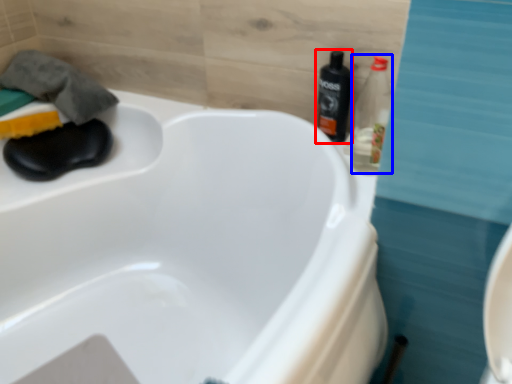
Question: Which point is closer to the camera, bottle (highlighted by a red box) or bottle (highlighted by a blue box)?

Choices:
 (A) bottle
 (B) bottle

Answer: (B)